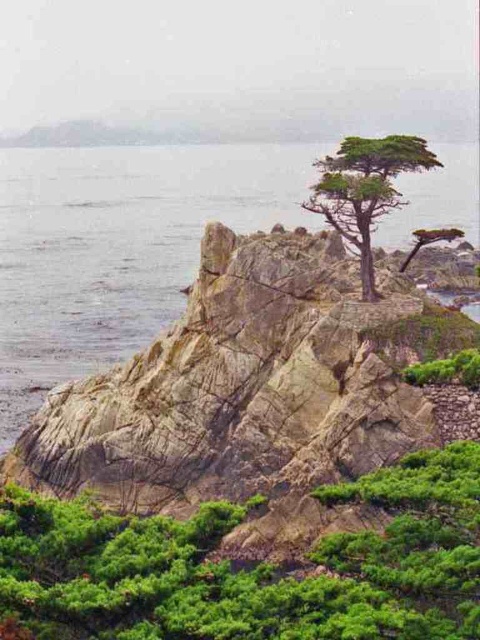
Consider the image. Which of these two, clear water at center or green textured tree at center, stands taller?

With more height is clear water at center.

Is clear water at center smaller than green textured tree at center?

Actually, clear water at center might be larger than green textured tree at center.

Between point (139, 253) and point (415, 164), which one is positioned behind?

The point (139, 253) is more distant.

This screenshot has width=480, height=640. What are the coordinates of `clear water at center` in the screenshot? It's located at (119, 248).